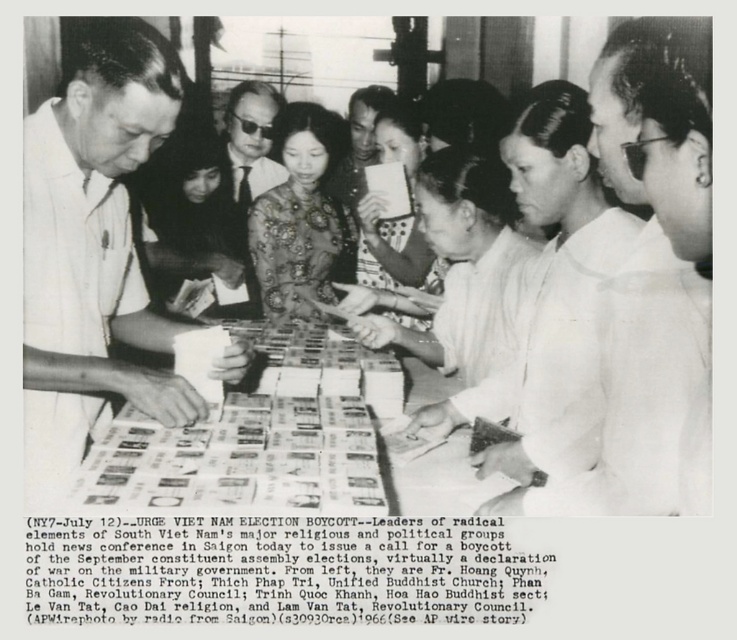
Question: Which point is farther to the camera?

Choices:
 (A) (674, 214)
 (B) (38, 458)
 (C) (273, 435)
 (D) (248, 154)

Answer: (D)

Question: Is white cloth shirt at right below white shirt at left?

Choices:
 (A) yes
 (B) no

Answer: (A)

Question: Is white cloth shirt at right positioned at the back of white paper at center?

Choices:
 (A) no
 (B) yes

Answer: (A)

Question: Which object appears farthest from the camera in this image?

Choices:
 (A) matte black suit at center
 (B) white paper at center
 (C) white shirt at left

Answer: (A)

Question: Does white shirt at left appear on the right side of matte black suit at center?

Choices:
 (A) no
 (B) yes

Answer: (B)

Question: Which point is farther to the camera?

Choices:
 (A) (63, 381)
 (B) (226, 124)

Answer: (B)